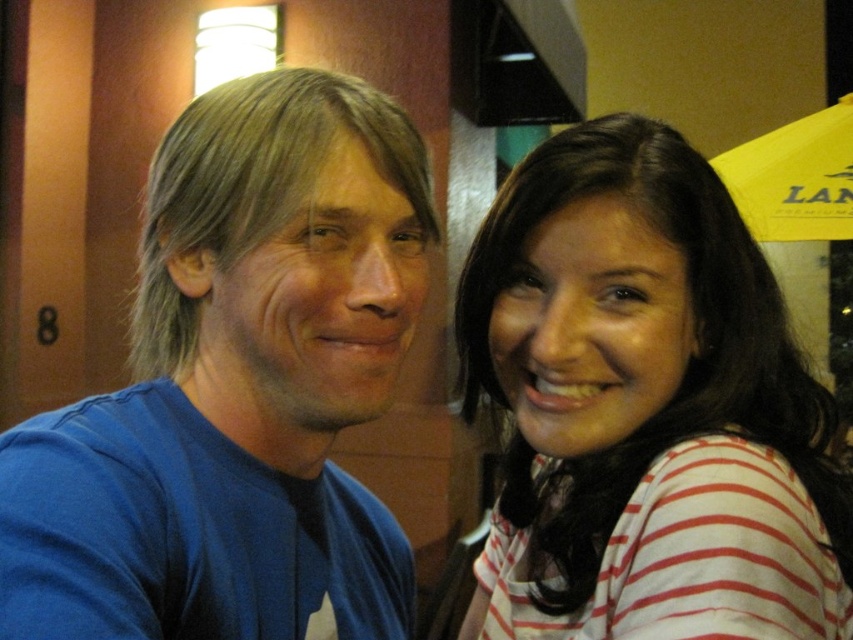
Does white striped shirt at right have a greater height compared to yellow fabric umbrella at upper right?

Incorrect, white striped shirt at right's height is not larger of yellow fabric umbrella at upper right's.

From the picture: Does white striped shirt at right have a lesser height compared to yellow fabric umbrella at upper right?

Yes, white striped shirt at right is shorter than yellow fabric umbrella at upper right.

Is point (770, 330) positioned in front of point (772, 211)?

Yes, it is in front of point (772, 211).

The width and height of the screenshot is (853, 640). What are the coordinates of `white striped shirt at right` in the screenshot? It's located at (645, 408).

In the scene shown: Can you confirm if blue cotton shirt at left is bigger than yellow fabric umbrella at upper right?

No.

Does blue cotton shirt at left have a lesser height compared to yellow fabric umbrella at upper right?

Yes, blue cotton shirt at left is shorter than yellow fabric umbrella at upper right.

Does point (107, 500) come farther from viewer compared to point (830, 138)?

No, (107, 500) is closer to viewer.

Locate an element on the screen. blue cotton shirt at left is located at coordinates (236, 387).

Which of these two, blue cotton shirt at left or white striped shirt at right, stands shorter?

blue cotton shirt at left

Between blue cotton shirt at left and white striped shirt at right, which one appears on the left side from the viewer's perspective?

blue cotton shirt at left

Image resolution: width=853 pixels, height=640 pixels. What do you see at coordinates (236, 387) in the screenshot?
I see `blue cotton shirt at left` at bounding box center [236, 387].

Image resolution: width=853 pixels, height=640 pixels. Identify the location of blue cotton shirt at left. (236, 387).